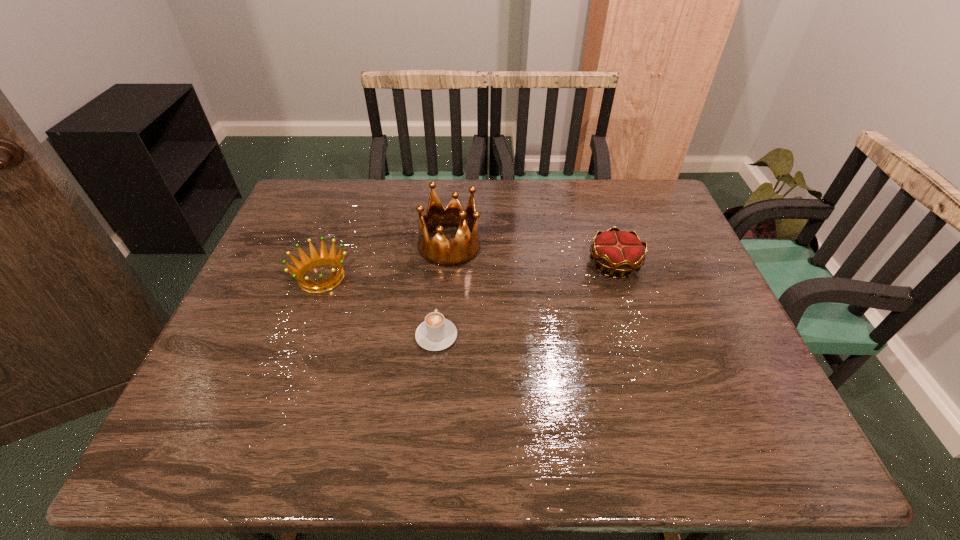
In order to click on the tallest object in this screenshot , I will do `click(439, 251)`.

Find the location of a particular element. This screenshot has height=540, width=960. the tallest crown is located at coordinates (439, 251).

At what (x,y) coordinates should I click in order to perform the action: click on the rightmost object. Please return your answer as a coordinate pair (x, y). Looking at the image, I should click on (617, 251).

Where is `the leftmost object`? Image resolution: width=960 pixels, height=540 pixels. the leftmost object is located at coordinates (315, 260).

At what (x,y) coordinates should I click in order to perform the action: click on the shortest object. Please return your answer as a coordinate pair (x, y). Looking at the image, I should click on (436, 333).

Identify the location of cappuccino. (436, 333).

This screenshot has width=960, height=540. Find the location of `vacant space located on the front of the second crown from right to left`. vacant space located on the front of the second crown from right to left is located at coordinates (442, 354).

Where is `free space located 0.130m on the left of the rightmost object`? The height and width of the screenshot is (540, 960). free space located 0.130m on the left of the rightmost object is located at coordinates (541, 264).

Where is `free point located on the left of the leftmost object`? The width and height of the screenshot is (960, 540). free point located on the left of the leftmost object is located at coordinates (271, 278).

Locate an element on the screen. blank space located 0.400m to the right of the cappuccino is located at coordinates (446, 220).